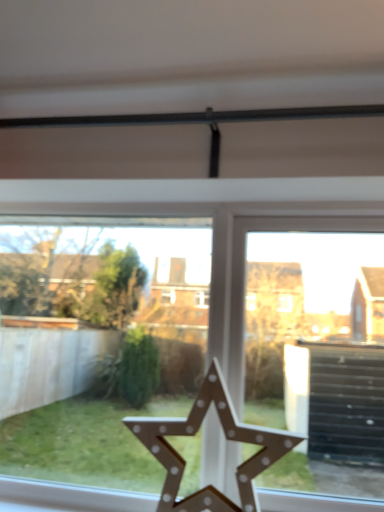
Question: Based on their sizes in the image, would you say wooden star at center is bigger or smaller than wooden star at center?

Choices:
 (A) small
 (B) big

Answer: (A)

Question: Relative to wooden star at center, is wooden star at center in front or behind?

Choices:
 (A) front
 (B) behind

Answer: (A)

Question: From a real-world perspective, is wooden star at center positioned above or below wooden star at center?

Choices:
 (A) above
 (B) below

Answer: (B)

Question: In terms of size, does wooden star at center appear bigger or smaller than wooden star at center?

Choices:
 (A) small
 (B) big

Answer: (B)

Question: Considering the positions of wooden star at center and wooden star at center in the image, is wooden star at center taller or shorter than wooden star at center?

Choices:
 (A) tall
 (B) short

Answer: (A)

Question: Is wooden star at center to the left or to the right of wooden star at center in the image?

Choices:
 (A) left
 (B) right

Answer: (A)

Question: Do you think wooden star at center is within wooden star at center, or outside of it?

Choices:
 (A) outside
 (B) inside

Answer: (A)